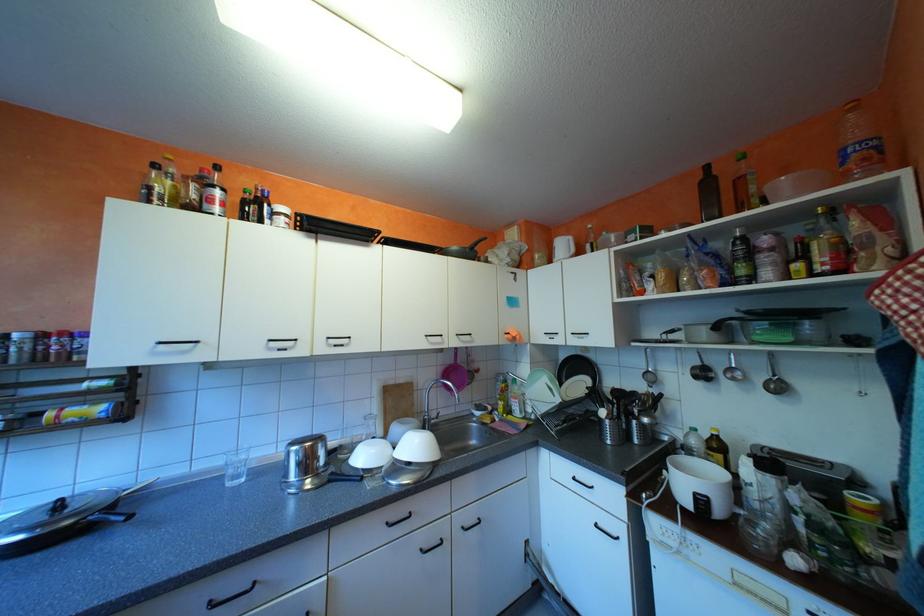
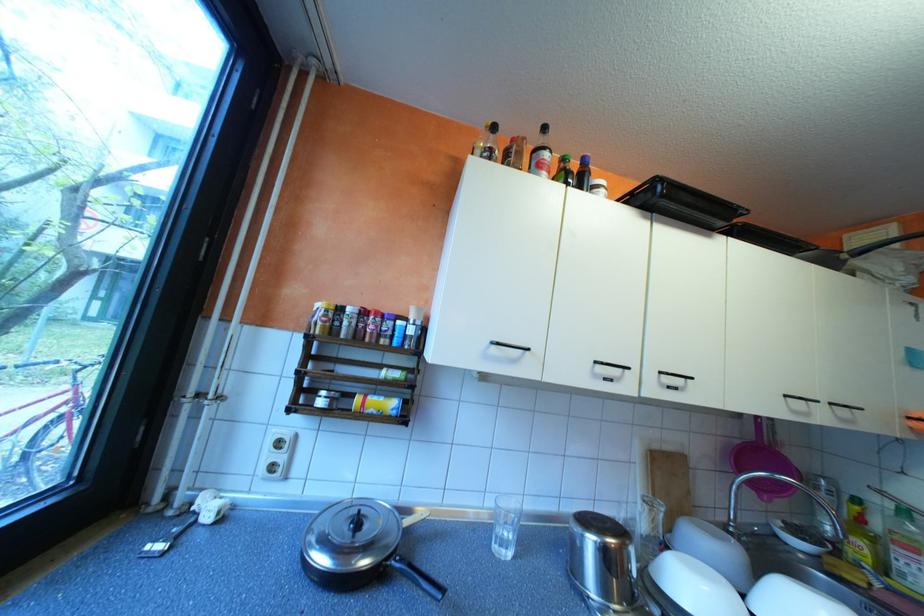
In the second image, find the point that corresponds to the point at 341,344 in the first image.

(673, 383)